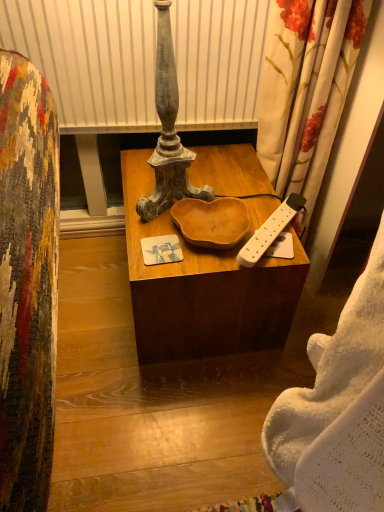
Identify the location of vacant region in front of wooden bowl at center. (174, 414).